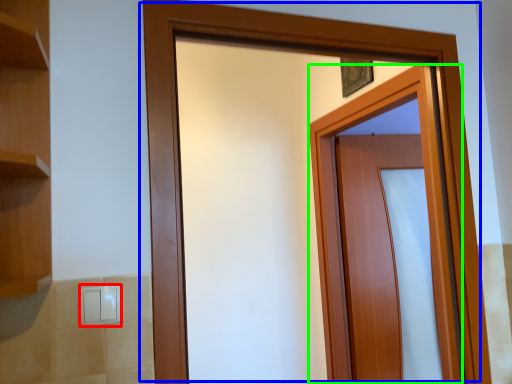
Question: Which object is the closest to the light switch (highlighted by a red box)? Choose among these: door (highlighted by a blue box) or door (highlighted by a green box).

Choices:
 (A) door
 (B) door

Answer: (A)